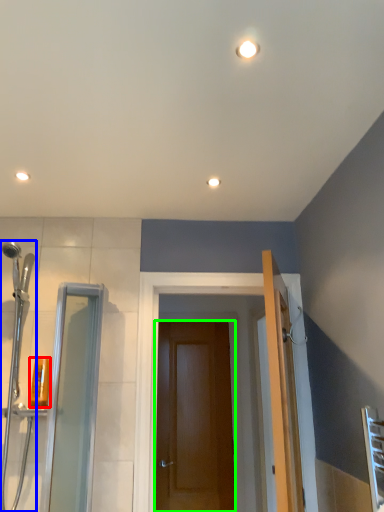
Question: Based on their relative distances, which object is farther from toiletry (highlighted by a red box)? Choose from shower door (highlighted by a blue box) and door (highlighted by a green box).

Choices:
 (A) shower door
 (B) door

Answer: (B)